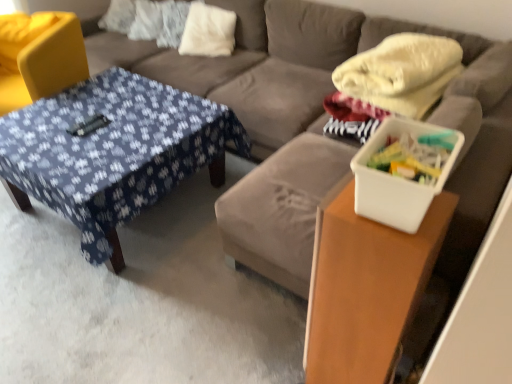
What is the approximate height of white plastic container at right?

white plastic container at right is 5.75 inches tall.

Measure the distance between point (196,51) and camera.

The depth of point (196,51) is 2.93 meters.

What are the coordinates of `white soft pillow at upper center` in the screenshot? It's located at (208, 31).

You are a GUI agent. You are given a task and a screenshot of the screen. Output one action in this format:
    pyautogui.click(x=<x>, y=<y>)
    Task: Click on the yellow fabric swivel chair at left
    This screenshot has height=384, width=512.
    Given the screenshot: What is the action you would take?
    pyautogui.click(x=42, y=62)

Is white plastic container at right, the second table positioned from the back, oriented away from yellow fabric swivel chair at left?

No, white plastic container at right, the second table positioned from the back, is not facing away from yellow fabric swivel chair at left.

From the image's perspective, between white plastic container at right, the 2th table in the left-to-right sequence, and yellow fabric swivel chair at left, who is located below?

white plastic container at right, the 2th table in the left-to-right sequence, is shown below in the image.

Does point (314, 298) appear closer or farther from the camera than point (18, 59)?

Point (314, 298) is closer to the camera than point (18, 59).

Is yellow fabric swivel chair at left located within white plastic container at right, the 2th table in the left-to-right sequence?

No, yellow fabric swivel chair at left is not surrounded by white plastic container at right, the 2th table in the left-to-right sequence.

Does point (16, 67) come behind point (194, 17)?

No, it is not.

From a real-world perspective, who is located lower, yellow fabric swivel chair at left or white soft pillow at upper center?

In real-world perspective, yellow fabric swivel chair at left is lower.

Is yellow fabric swivel chair at left to the left of white soft pillow at upper center from the viewer's perspective?

Yes, yellow fabric swivel chair at left is to the left of white soft pillow at upper center.

From the picture: Is yellow fabric swivel chair at left facing towards blue fabric futon at center?

No.

Considering the sizes of objects yellow fabric swivel chair at left and blue fabric futon at center in the image provided, who is wider, yellow fabric swivel chair at left or blue fabric futon at center?

blue fabric futon at center is wider.

At what (x,y) coordinates should I click in order to perform the action: click on swivel chair located underneath the blue fabric futon at center (from a real-world perspective). Please return your answer as a coordinate pair (x, y). This screenshot has height=384, width=512. Looking at the image, I should click on (42, 62).

From the image's perspective, is yellow fabric swivel chair at left on top of blue fabric futon at center?

Incorrect, from the image's perspective, yellow fabric swivel chair at left is lower than blue fabric futon at center.

Considering the sizes of objects blue fabric-covered table at center, acting as the first table starting from the left, and white soft pillow at upper center in the image provided, who is taller, blue fabric-covered table at center, acting as the first table starting from the left, or white soft pillow at upper center?

white soft pillow at upper center.

Which of these two, blue fabric-covered table at center, which is the 2th table in front-to-back order, or white soft pillow at upper center, is wider?

blue fabric-covered table at center, which is the 2th table in front-to-back order.

From a real-world perspective, which table is the 2nd one underneath the white soft pillow at upper center? Please provide its 2D coordinates.

[(112, 151)]

Is white plastic container at right, the first table from the front, in front of or behind blue fabric futon at center in the image?

In the image, white plastic container at right, the first table from the front, appears in front of blue fabric futon at center.

Can you tell me how much white plastic container at right, the 1th table in the right-to-left sequence, and blue fabric futon at center differ in facing direction?

white plastic container at right, the 1th table in the right-to-left sequence, and blue fabric futon at center are facing 90 degrees away from each other.

Is white plastic container at right, the 1th table in the right-to-left sequence, positioned with its back to blue fabric futon at center?

That's not correct — white plastic container at right, the 1th table in the right-to-left sequence, is not looking away from blue fabric futon at center.

Consider the image. From a real-world perspective, between white plastic container at right, the second table positioned from the back, and blue fabric futon at center, who is vertically higher?

In real-world perspective, white plastic container at right, the second table positioned from the back, is above.

From a real-world perspective, is blue fabric futon at center positioned above or below yellow fabric swivel chair at left?

blue fabric futon at center is above yellow fabric swivel chair at left.

Considering the sizes of blue fabric futon at center and yellow fabric swivel chair at left in the image, is blue fabric futon at center taller or shorter than yellow fabric swivel chair at left?

In the image, blue fabric futon at center appears to be taller than yellow fabric swivel chair at left.

Is blue fabric futon at center inside or outside of yellow fabric swivel chair at left?

blue fabric futon at center is not enclosed by yellow fabric swivel chair at left.

Can you confirm if blue fabric futon at center is bigger than yellow fabric swivel chair at left?

Yes.

Between blue fabric-covered table at center, which is the 2th table in front-to-back order, and yellow fabric swivel chair at left, which one appears on the left side from the viewer's perspective?

yellow fabric swivel chair at left.

Would you consider blue fabric-covered table at center, which is the 2th table in front-to-back order, to be distant from yellow fabric swivel chair at left?

No, there isn't a large distance between blue fabric-covered table at center, which is the 2th table in front-to-back order, and yellow fabric swivel chair at left.

Is blue fabric-covered table at center, which is the 2th table in front-to-back order, located outside yellow fabric swivel chair at left?

That's correct, blue fabric-covered table at center, which is the 2th table in front-to-back order, is outside of yellow fabric swivel chair at left.

The height and width of the screenshot is (384, 512). Identify the location of swivel chair above the white plastic container at right, the second table positioned from the back (from the image's perspective). (42, 62).

Locate an element on the screen. swivel chair that is below the white soft pillow at upper center (from the image's perspective) is located at coordinates (42, 62).

Estimate the real-world distances between objects in this image. Which object is further from white soft pillow at upper center, yellow fabric swivel chair at left or blue fabric futon at center?

The object further to white soft pillow at upper center is yellow fabric swivel chair at left.

Considering their positions, is white plastic container at right, the 2th table in the left-to-right sequence, positioned further to yellow fabric swivel chair at left than blue fabric-covered table at center, acting as the first table starting from the left?

white plastic container at right, the 2th table in the left-to-right sequence.

Considering their positions, is blue fabric futon at center positioned closer to white soft pillow at upper center than blue fabric-covered table at center, acting as the first table starting from the left?

The object closer to white soft pillow at upper center is blue fabric futon at center.

Considering their positions, is yellow fabric swivel chair at left positioned closer to blue fabric-covered table at center, acting as the first table starting from the left, than blue fabric futon at center?

blue fabric futon at center is positioned closer to the anchor blue fabric-covered table at center, acting as the first table starting from the left.

Estimate the real-world distances between objects in this image. Which object is further from white plastic container at right, blue fabric-covered table at center, marked as the 2th table in a right-to-left arrangement, or white soft pillow at upper center?

Among the two, white soft pillow at upper center is located further to white plastic container at right.

When comparing their distances from white soft pillow at upper center, does blue fabric-covered table at center, acting as the first table starting from the left, or yellow fabric swivel chair at left seem further?

blue fabric-covered table at center, acting as the first table starting from the left, lies further to white soft pillow at upper center than the other object.

Looking at the image, which one is located closer to white soft pillow at upper center, white plastic container at right, the second table positioned from the back, or yellow fabric swivel chair at left?

Based on the image, yellow fabric swivel chair at left appears to be nearer to white soft pillow at upper center.

Which object lies further to the anchor point yellow fabric swivel chair at left, blue fabric-covered table at center, which is the 2th table in front-to-back order, or white plastic container at right, the second table positioned from the back?

Based on the image, white plastic container at right, the second table positioned from the back, appears to be further to yellow fabric swivel chair at left.

Image resolution: width=512 pixels, height=384 pixels. Find the location of `table between blue fabric-covered table at center, placed as the 1th table when sorted from back to front, and white plastic container at right, in the horizontal direction`. table between blue fabric-covered table at center, placed as the 1th table when sorted from back to front, and white plastic container at right, in the horizontal direction is located at coordinates (365, 287).

You are a GUI agent. You are given a task and a screenshot of the screen. Output one action in this format:
    pyautogui.click(x=<x>, y=<y>)
    Task: Click on the table positioned between white plastic container at right, the second table positioned from the back, and white soft pillow at upper center from near to far
    
    Given the screenshot: What is the action you would take?
    pyautogui.click(x=112, y=151)

I want to click on futon between yellow fabric swivel chair at left and white plastic container at right from left to right, so click(280, 60).

Find the location of a particular element. The height and width of the screenshot is (384, 512). table between yellow fabric swivel chair at left and blue fabric futon at center in the horizontal direction is located at coordinates (112, 151).